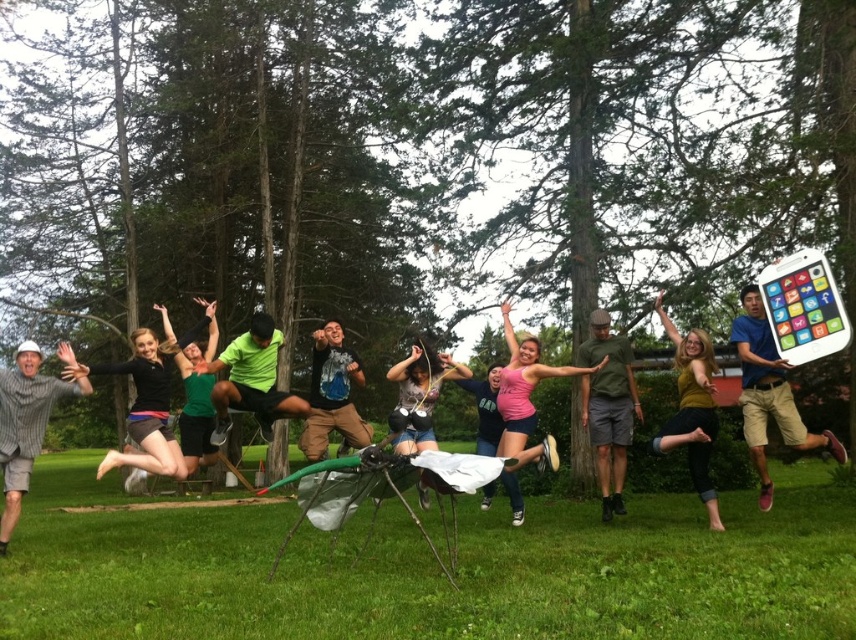
Question: Observing the image, what is the correct spatial positioning of striped cotton shirt at left in reference to green fabric shorts at center?

Choices:
 (A) below
 (B) above

Answer: (A)

Question: Among these objects, which one is farthest from the camera?

Choices:
 (A) matte black shorts at center
 (B) white matte tablet at center
 (C) pink matte shirt at center

Answer: (C)

Question: Based on their relative distances, which object is farther from the black matte shorts at center?

Choices:
 (A) matte black shorts at center
 (B) striped cotton shirt at left

Answer: (A)

Question: Which point is closer to the camera taking this photo?

Choices:
 (A) (687, 364)
 (B) (629, 429)

Answer: (A)

Question: Does black matte shorts at center appear over pink matte tank top at center?

Choices:
 (A) no
 (B) yes

Answer: (B)

Question: Does white matte tablet at center appear on the left side of green jersey at center?

Choices:
 (A) no
 (B) yes

Answer: (A)